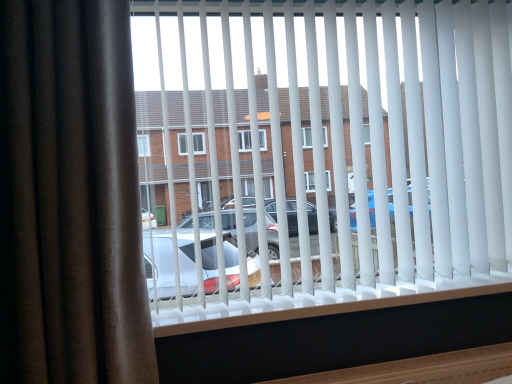
Where is `white plastic blinds at center`? This screenshot has width=512, height=384. white plastic blinds at center is located at coordinates click(x=306, y=142).

The image size is (512, 384). What do you see at coordinates (306, 142) in the screenshot?
I see `white plastic blinds at center` at bounding box center [306, 142].

This screenshot has height=384, width=512. Describe the element at coordinates (70, 197) in the screenshot. I see `brown velvet curtain at left` at that location.

Find the location of a particular element. brown velvet curtain at left is located at coordinates (70, 197).

In order to click on white plastic blinds at center in this screenshot , I will do `click(306, 142)`.

Considering the relative positions of white plastic blinds at center and brown velvet curtain at left in the image provided, is white plastic blinds at center to the left of brown velvet curtain at left from the viewer's perspective?

In fact, white plastic blinds at center is to the right of brown velvet curtain at left.

Which is in front, white plastic blinds at center or brown velvet curtain at left?

brown velvet curtain at left is closer to the camera.

Is point (342, 135) positioned behind point (83, 107)?

Yes.

From the image's perspective, would you say white plastic blinds at center is positioned over brown velvet curtain at left?

Yes, from the image's perspective, white plastic blinds at center is on top of brown velvet curtain at left.

From a real-world perspective, is white plastic blinds at center physically below brown velvet curtain at left?

No, from a real-world perspective, white plastic blinds at center is not below brown velvet curtain at left.

Is white plastic blinds at center thinner than brown velvet curtain at left?

Yes.

Between white plastic blinds at center and brown velvet curtain at left, which one has less height?

Standing shorter between the two is white plastic blinds at center.

Can you confirm if white plastic blinds at center is bigger than brown velvet curtain at left?

Correct, white plastic blinds at center is larger in size than brown velvet curtain at left.

Is brown velvet curtain at left completely or partially inside white plastic blinds at center?

That's incorrect, brown velvet curtain at left is not inside white plastic blinds at center.

Is there a large distance between white plastic blinds at center and brown velvet curtain at left?

No, white plastic blinds at center is not far away from brown velvet curtain at left.

Could you tell me if white plastic blinds at center is turned towards brown velvet curtain at left?

No, white plastic blinds at center is not oriented towards brown velvet curtain at left.

Can you tell me how much white plastic blinds at center and brown velvet curtain at left differ in facing direction?

The angle between the facing direction of white plastic blinds at center and the facing direction of brown velvet curtain at left is 0.000968 degrees.

This screenshot has height=384, width=512. I want to click on bay window on the right side of brown velvet curtain at left, so click(306, 142).

Can you confirm if brown velvet curtain at left is positioned to the left of white plastic blinds at center?

Yes, brown velvet curtain at left is to the left of white plastic blinds at center.

Looking at this image, is brown velvet curtain at left in front of white plastic blinds at center?

Yes.

Considering the points (86, 145) and (392, 273), which point is behind, point (86, 145) or point (392, 273)?

Positioned behind is point (392, 273).

From the image's perspective, is brown velvet curtain at left located above white plastic blinds at center?

No.

From a real-world perspective, is brown velvet curtain at left physically below white plastic blinds at center?

Yes, from a real-world perspective, brown velvet curtain at left is beneath white plastic blinds at center.

Is brown velvet curtain at left wider or thinner than white plastic blinds at center?

Considering their sizes, brown velvet curtain at left looks broader than white plastic blinds at center.

Considering the sizes of objects brown velvet curtain at left and white plastic blinds at center in the image provided, who is shorter, brown velvet curtain at left or white plastic blinds at center?

white plastic blinds at center.

Considering the sizes of objects brown velvet curtain at left and white plastic blinds at center in the image provided, who is smaller, brown velvet curtain at left or white plastic blinds at center?

Smaller between the two is brown velvet curtain at left.

Is brown velvet curtain at left inside the boundaries of white plastic blinds at center, or outside?

The correct answer is: outside.

Is brown velvet curtain at left with white plastic blinds at center?

They are not placed beside each other.

Consider the image. Is brown velvet curtain at left oriented towards white plastic blinds at center?

No.

What's the angular difference between brown velvet curtain at left and white plastic blinds at center's facing directions?

brown velvet curtain at left and white plastic blinds at center are facing 0.000968 degrees away from each other.

Consider the image. Measure the distance from brown velvet curtain at left to white plastic blinds at center.

The distance of brown velvet curtain at left from white plastic blinds at center is 50.21 centimeters.

Locate an element on the screen. The height and width of the screenshot is (384, 512). bay window above the brown velvet curtain at left (from the image's perspective) is located at coordinates (306, 142).

Locate an element on the screen. The width and height of the screenshot is (512, 384). bay window above the brown velvet curtain at left (from a real-world perspective) is located at coordinates (306, 142).

Find the location of a particular element. The image size is (512, 384). curtain below the white plastic blinds at center (from a real-world perspective) is located at coordinates (70, 197).